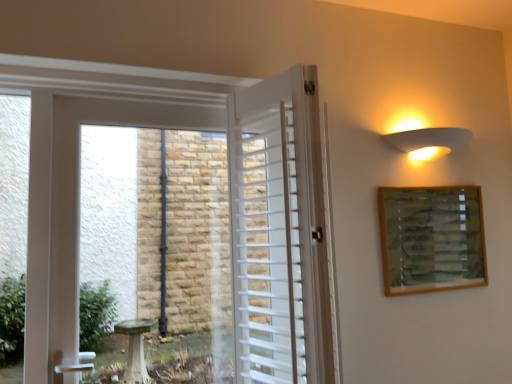
Question: Is wooden picture frame at upper right not within white matte wall sconce at upper right?

Choices:
 (A) yes
 (B) no

Answer: (A)

Question: Does wooden picture frame at upper right have a greater width compared to white matte wall sconce at upper right?

Choices:
 (A) yes
 (B) no

Answer: (B)

Question: Can you see wooden picture frame at upper right touching white matte wall sconce at upper right?

Choices:
 (A) no
 (B) yes

Answer: (A)

Question: Can you confirm if wooden picture frame at upper right is bigger than white matte wall sconce at upper right?

Choices:
 (A) yes
 (B) no

Answer: (A)

Question: Is white matte wall sconce at upper right at the back of wooden picture frame at upper right?

Choices:
 (A) yes
 (B) no

Answer: (B)

Question: From the image's perspective, is wooden picture frame at upper right on white matte wall sconce at upper right?

Choices:
 (A) no
 (B) yes

Answer: (A)

Question: Does white wooden door at center have a greater width compared to wooden picture frame at upper right?

Choices:
 (A) no
 (B) yes

Answer: (B)

Question: Is the position of white wooden door at center less distant than that of wooden picture frame at upper right?

Choices:
 (A) yes
 (B) no

Answer: (A)

Question: Does white wooden door at center have a larger size compared to wooden picture frame at upper right?

Choices:
 (A) no
 (B) yes

Answer: (B)

Question: From the image's perspective, is white wooden door at center above wooden picture frame at upper right?

Choices:
 (A) no
 (B) yes

Answer: (B)

Question: Does white wooden door at center lie behind wooden picture frame at upper right?

Choices:
 (A) no
 (B) yes

Answer: (A)

Question: Can you confirm if white wooden door at center is positioned to the right of wooden picture frame at upper right?

Choices:
 (A) yes
 (B) no

Answer: (B)

Question: Can you confirm if white wooden door at center is smaller than white matte wall sconce at upper right?

Choices:
 (A) yes
 (B) no

Answer: (B)